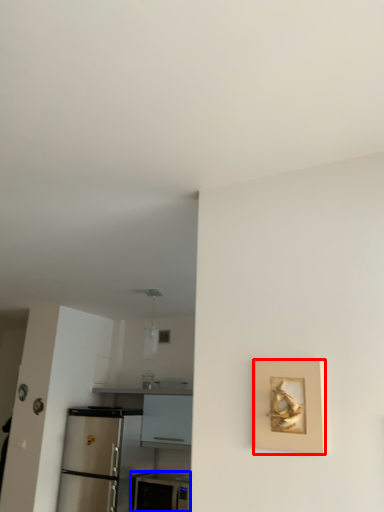
Question: Which object appears farthest to the camera in this image, picture frame (highlighted by a red box) or appliance (highlighted by a blue box)?

Choices:
 (A) picture frame
 (B) appliance

Answer: (B)